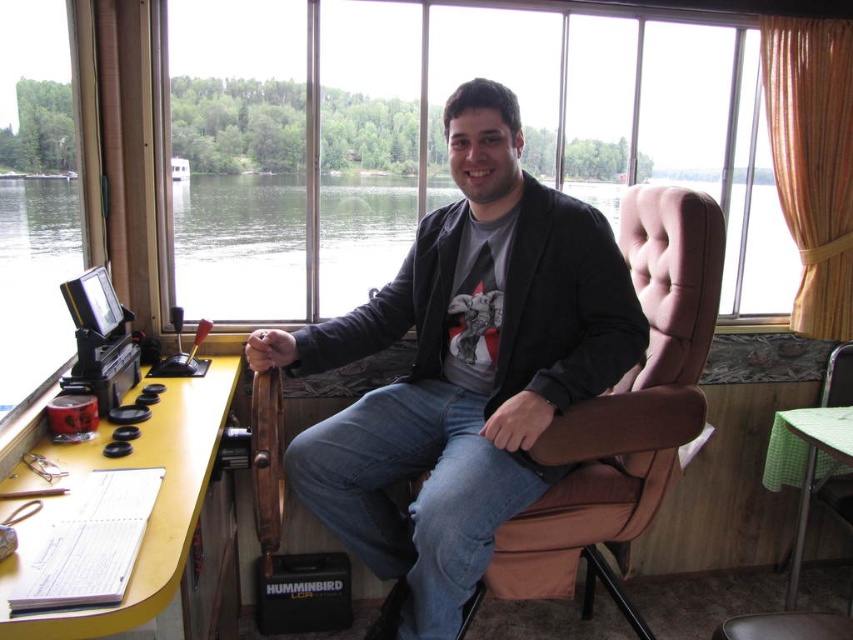
Question: From the image, what is the correct spatial relationship of transparent glass water at center in relation to green checkered table at lower right?

Choices:
 (A) right
 (B) left

Answer: (B)

Question: Which object is farther from the camera taking this photo?

Choices:
 (A) green checkered table at lower right
 (B) transparent glass window at center
 (C) yellow wood table at lower left

Answer: (B)

Question: Which of the following is the farthest from the observer?

Choices:
 (A) (67, 614)
 (B) (743, 282)

Answer: (B)

Question: Which point is farther from the camera taking this photo?

Choices:
 (A) (798, 547)
 (B) (403, 22)
 (C) (120, 458)
 (D) (457, 172)

Answer: (A)

Question: Does matte black jacket at center appear on the left side of yellow wood table at lower left?

Choices:
 (A) yes
 (B) no

Answer: (B)

Question: From the image, what is the correct spatial relationship of matte black jacket at center in relation to yellow wood table at lower left?

Choices:
 (A) above
 (B) below

Answer: (A)